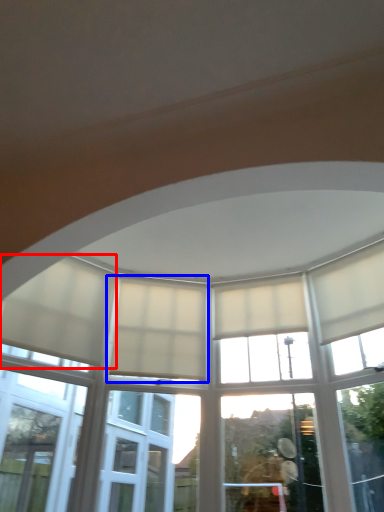
Question: Which point is further to the camera, curtain (highlighted by a red box) or curtain (highlighted by a blue box)?

Choices:
 (A) curtain
 (B) curtain

Answer: (B)